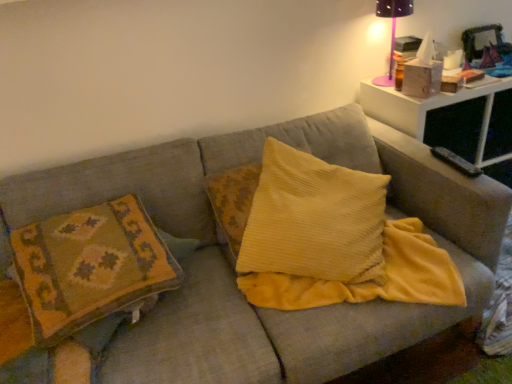
Question: From the image's perspective, is pink plastic table lamp at upper right above or below white plastic table at upper right?

Choices:
 (A) above
 (B) below

Answer: (A)

Question: In terms of width, does pink plastic table lamp at upper right look wider or thinner when compared to white plastic table at upper right?

Choices:
 (A) thin
 (B) wide

Answer: (A)

Question: Which object is positioned closest to the textured fabric couch at center?

Choices:
 (A) white plastic table at upper right
 (B) yellow corduroy pillow at center, the second pillow from the left
 (C) pink plastic table lamp at upper right
 (D) textured woolen pillow at left, which is counted as the second pillow, starting from the right

Answer: (B)

Question: Estimate the real-world distances between objects in this image. Which object is farther from the pink plastic table lamp at upper right?

Choices:
 (A) textured fabric couch at center
 (B) yellow corduroy pillow at center, the second pillow from the left
 (C) white plastic table at upper right
 (D) textured woolen pillow at left, which is counted as the second pillow, starting from the right

Answer: (D)